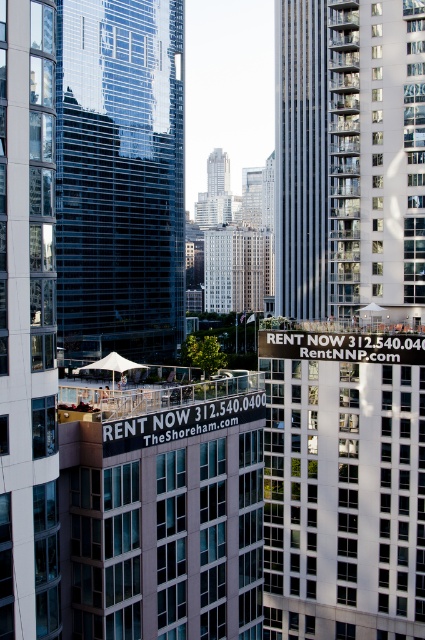
Is white glass building at right positioned before smooth gray skyscraper at center?

Yes, white glass building at right is closer to the viewer.

Can you confirm if white glass building at right is smaller than smooth gray skyscraper at center?

No, white glass building at right is not smaller than smooth gray skyscraper at center.

Which is behind, point (363, 77) or point (309, 132)?

Positioned behind is point (309, 132).

I want to click on white glass building at right, so click(376, 157).

Does transparent glass building at center have a greater width compared to smooth gray skyscraper at center?

Yes, transparent glass building at center is wider than smooth gray skyscraper at center.

Can you confirm if transparent glass building at center is shorter than smooth gray skyscraper at center?

In fact, transparent glass building at center may be taller than smooth gray skyscraper at center.

What do you see at coordinates (119, 179) in the screenshot?
I see `transparent glass building at center` at bounding box center [119, 179].

This screenshot has height=640, width=425. Find the location of `transparent glass building at center`. transparent glass building at center is located at coordinates (119, 179).

Between transparent glass building at center and white glass building at right, which one has more height?

With more height is transparent glass building at center.

Does transparent glass building at center lie behind white glass building at right?

No, it is not.

You are a GUI agent. You are given a task and a screenshot of the screen. Output one action in this format:
    pyautogui.click(x=<x>, y=<y>)
    Task: Click on the transparent glass building at center
    
    Given the screenshot: What is the action you would take?
    pyautogui.click(x=119, y=179)